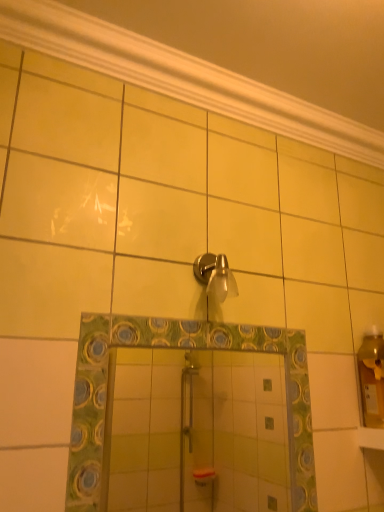
Question: From the image's perspective, is green mosaic mirror at center positioned above or below white glossy molding at upper center?

Choices:
 (A) above
 (B) below

Answer: (B)

Question: Considering the relative positions of green mosaic mirror at center and white glossy molding at upper center in the image provided, is green mosaic mirror at center to the left or to the right of white glossy molding at upper center?

Choices:
 (A) right
 (B) left

Answer: (B)

Question: Considering the real-world distances, which object is closest to the satin nickel shower head at upper center?

Choices:
 (A) green mosaic mirror at center
 (B) white glossy molding at upper center

Answer: (B)

Question: Which is farther from the white glossy molding at upper center?

Choices:
 (A) satin nickel shower head at upper center
 (B) green mosaic mirror at center

Answer: (B)